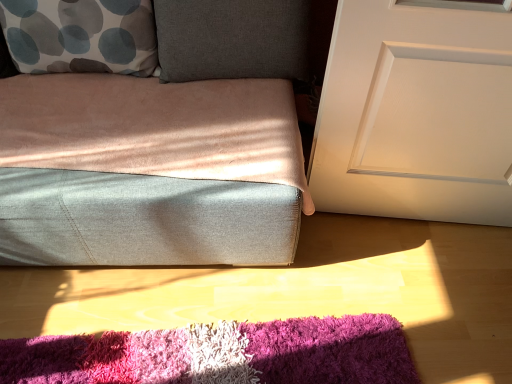
Where is `vacant area that is in front of white matte door at right`? The image size is (512, 384). vacant area that is in front of white matte door at right is located at coordinates (428, 283).